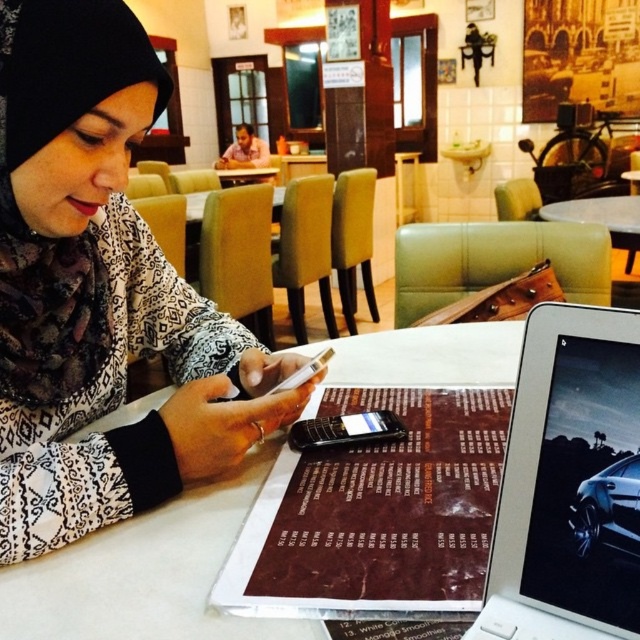
Question: Is white glossy table at center wider than matte skin man at upper center?

Choices:
 (A) no
 (B) yes

Answer: (B)

Question: Is white glossy table at center closer to the viewer compared to matte skin man at upper center?

Choices:
 (A) yes
 (B) no

Answer: (A)

Question: Considering the real-world distances, which object is closest to the black glossy smartphone at center?

Choices:
 (A) matte black phone at center
 (B) matte skin man at upper center

Answer: (A)

Question: Can you confirm if brown paper menu at center is thinner than white glossy table at center?

Choices:
 (A) yes
 (B) no

Answer: (A)

Question: Which object is farther from the camera taking this photo?

Choices:
 (A) matte black phone at center
 (B) white glossy table at center

Answer: (B)

Question: Among these objects, which one is nearest to the camera?

Choices:
 (A) black glossy smartphone at center
 (B) matte skin man at upper center
 (C) matte black phone at center

Answer: (C)